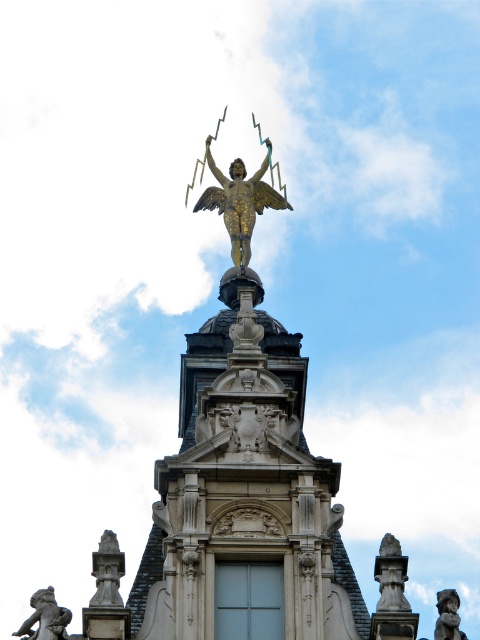
You are an art conservator assessing the structural integrity of the gold metallic statue at upper center and the bronze statue at lower right. Based on their dimensions, which statue might require additional support to prevent toppling over?

The gold metallic statue at upper center is thinner than the bronze statue at lower right, so it might require additional support to prevent toppling over.

You are an architect analyzing the classical building structure. You notice the gold metallic statue at upper center and the bronze statue at lower left. Based on their positions, which one is located higher up in the structure?

The gold metallic statue at upper center is positioned over the bronze statue at lower left, so it is located higher up in the structure.